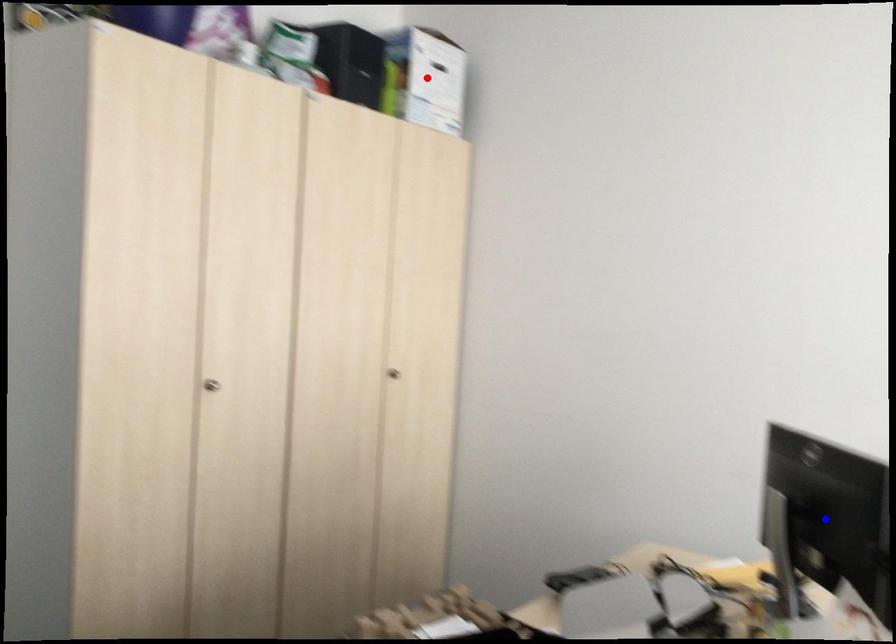
Question: Two points are marked on the image. Which point is closer to the camera?

Choices:
 (A) Blue point is closer.
 (B) Red point is closer.

Answer: (A)